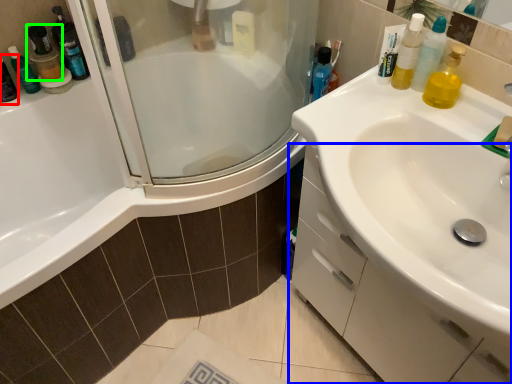
Question: Estimate the real-world distances between objects in this image. Which object is closer to mouthwash (highlighted by a red box), bathroom cabinet (highlighted by a blue box) or mouthwash (highlighted by a green box)?

Choices:
 (A) bathroom cabinet
 (B) mouthwash

Answer: (B)